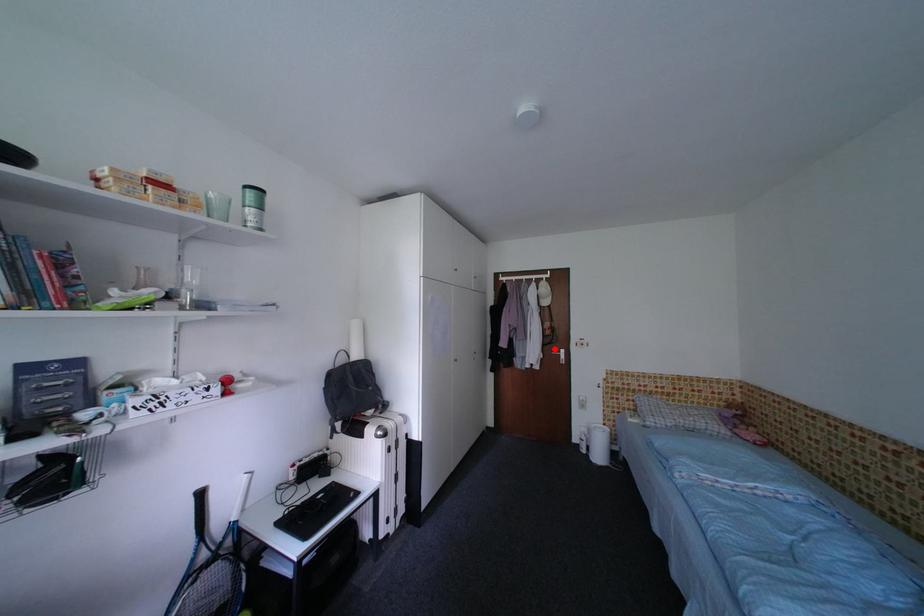
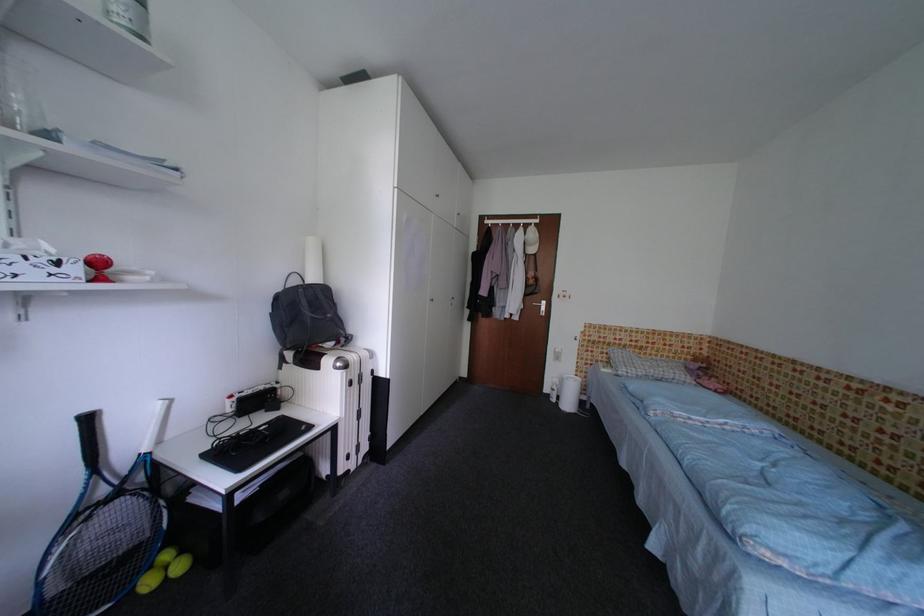
Question: A red point is marked in image1. In image2, is the corresponding 3D point closer to the camera or farther? Reply with the corresponding letter.

Choices:
 (A) The corresponding 3D point is closer.
 (B) The corresponding 3D point is farther.

Answer: (A)